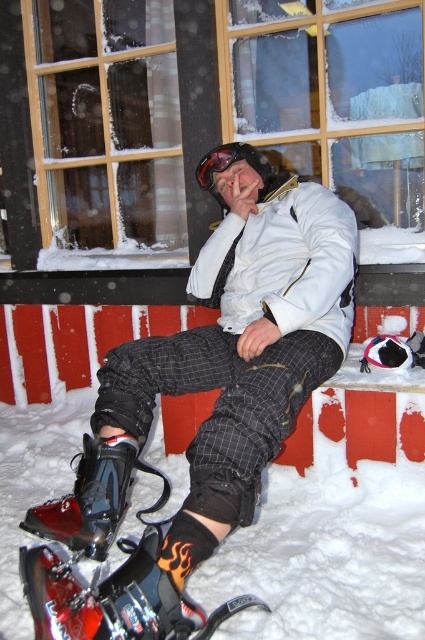
Is the matte black snowboard at center located at the point with coordinates (x=212, y=408)?

Yes, the matte black snowboard at center is located at point (x=212, y=408).

What is the coordinate of the matte black snowboard at center?

The matte black snowboard at center is located at coordinate point (x=212, y=408).